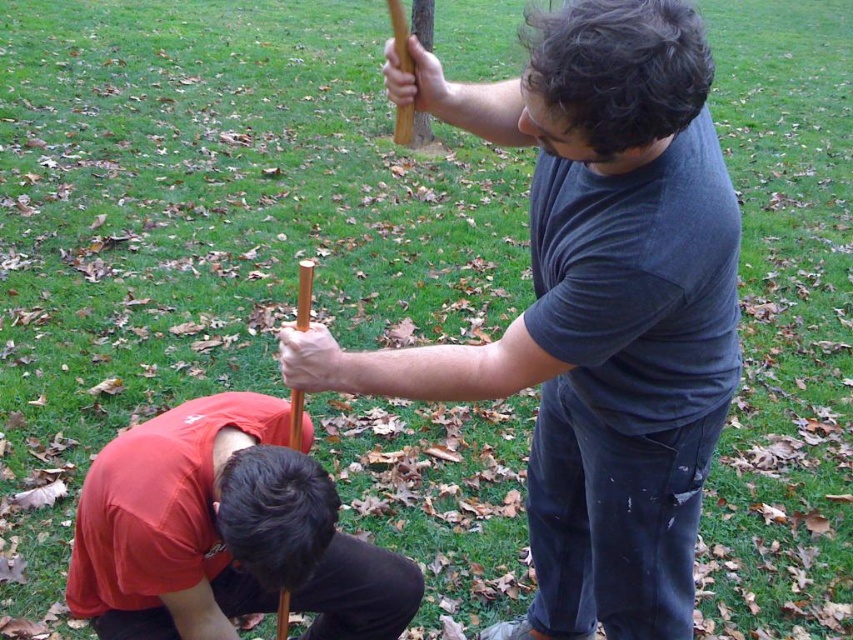
Question: Does matte black shirt at upper right have a smaller size compared to matte red shirt at lower left?

Choices:
 (A) no
 (B) yes

Answer: (A)

Question: Is matte black shirt at upper right positioned before matte red shirt at lower left?

Choices:
 (A) yes
 (B) no

Answer: (A)

Question: Among these points, which one is nearest to the camera?

Choices:
 (A) (268, 467)
 (B) (518, 317)

Answer: (A)

Question: Among these points, which one is nearest to the camera?

Choices:
 (A) (225, 400)
 (B) (625, 36)

Answer: (B)

Question: Is matte black shirt at upper right smaller than matte red shirt at lower left?

Choices:
 (A) yes
 (B) no

Answer: (B)